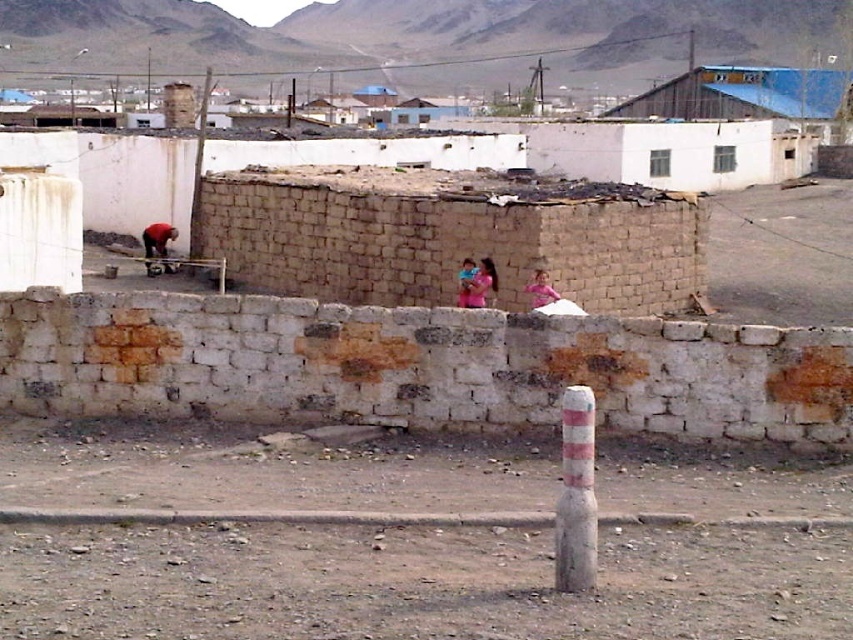
Question: Does white concrete pole at center appear on the left side of pink fabric child at center?

Choices:
 (A) no
 (B) yes

Answer: (B)

Question: Is brown dirt field at center bigger than pink fabric at center?

Choices:
 (A) no
 (B) yes

Answer: (A)

Question: Which point is closer to the camera?

Choices:
 (A) (532, 276)
 (B) (409, 588)
 (C) (463, 278)
 (D) (165, 266)

Answer: (B)

Question: Estimate the real-world distances between objects in this image. Which object is closer to the blue corrugated metal hut at upper center?

Choices:
 (A) white concrete pole at center
 (B) pink fabric at center
 (C) brown dirt field at center

Answer: (B)

Question: Considering the relative positions of red fabric shirt at left and pink fabric child at center in the image provided, where is red fabric shirt at left located with respect to pink fabric child at center?

Choices:
 (A) below
 (B) above

Answer: (B)

Question: Which of the following is the closest to the observer?

Choices:
 (A) blue corrugated metal hut at upper center
 (B) pink fabric at center
 (C) red fabric shirt at left

Answer: (B)